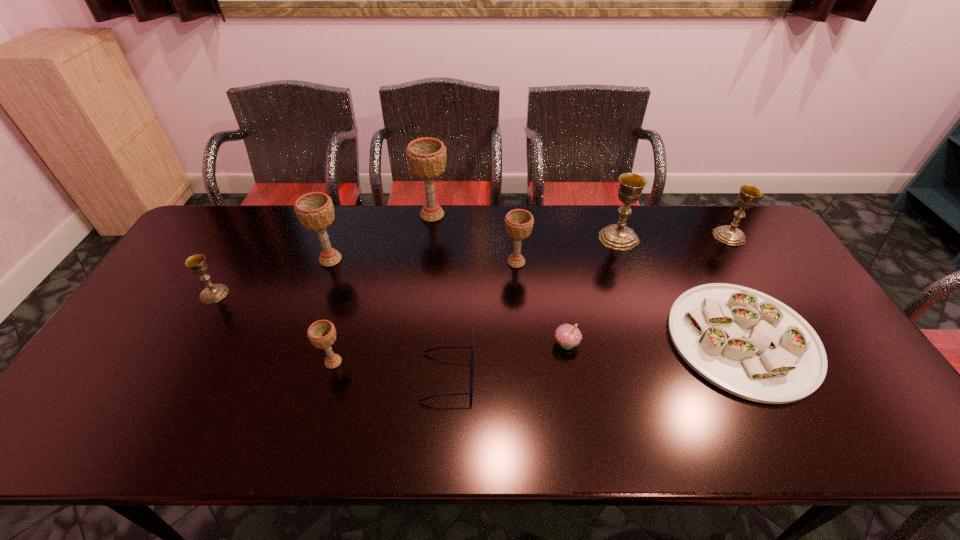
Find the location of a particular element. Image resolution: width=960 pixels, height=540 pixels. vacant region located on the right of the second chalice from right to left is located at coordinates (653, 238).

Find the location of a particular element. The height and width of the screenshot is (540, 960). free space located 0.160m on the front of the ninth object from right to left is located at coordinates (313, 311).

Identify the location of vacant space located on the right of the rightmost chalice. The image size is (960, 540). (763, 237).

Identify the location of vacant space located 0.070m on the right of the second smallest beige chalice. (552, 262).

Identify the location of free location located on the right of the second nearest chalice. The image size is (960, 540). (289, 294).

Where is `vacant region located 0.130m on the right of the third chalice from left to right`? The image size is (960, 540). vacant region located 0.130m on the right of the third chalice from left to right is located at coordinates click(x=396, y=362).

Find the location of a particular element. vacant space located on the back of the seventh object from left to right is located at coordinates (549, 244).

You are a GUI agent. You are given a task and a screenshot of the screen. Output one action in this format:
    pyautogui.click(x=<x>, y=<y>)
    Task: Click on the vacant space located 0.220m on the back of the platter
    This screenshot has width=960, height=540.
    Given the screenshot: What is the action you would take?
    pyautogui.click(x=690, y=239)

Locate an element on the screen. blank space located 0.400m on the front-facing side of the spectacles is located at coordinates (635, 377).

Identify the location of object located in the left edge section of the desktop. (213, 293).